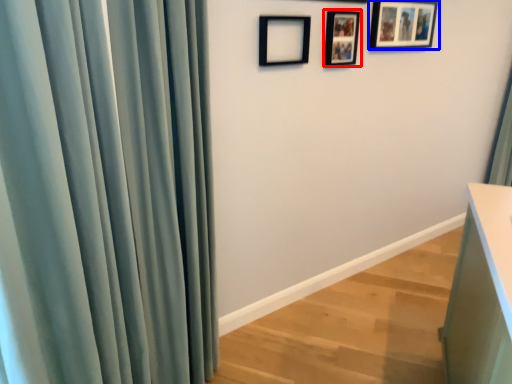
Question: Among these objects, which one is nearest to the camera, picture frame (highlighted by a red box) or picture frame (highlighted by a blue box)?

Choices:
 (A) picture frame
 (B) picture frame

Answer: (A)